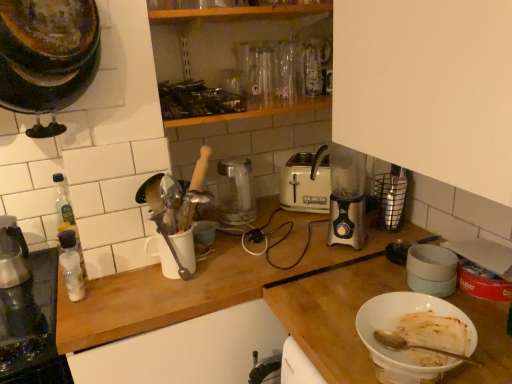
Question: Does white matte bowl at lower right, the 2th countertop when ordered from back to front, come in front of clear plastic bottle at left, the 1th bottle viewed from the front?

Choices:
 (A) no
 (B) yes

Answer: (B)

Question: From the image's perspective, does white matte bowl at lower right, the 2th countertop when ordered from back to front, appear higher than clear plastic bottle at left, the 1th bottle viewed from the front?

Choices:
 (A) no
 (B) yes

Answer: (A)

Question: Can you confirm if white matte bowl at lower right, the 2th countertop when ordered from back to front, is taller than clear plastic bottle at left, the second bottle in the back-to-front sequence?

Choices:
 (A) yes
 (B) no

Answer: (A)

Question: Can you confirm if white matte bowl at lower right, which is counted as the first countertop, starting from the front, is bigger than clear plastic bottle at left, the 1th bottle viewed from the front?

Choices:
 (A) yes
 (B) no

Answer: (A)

Question: From a real-world perspective, is white matte bowl at lower right, which is counted as the first countertop, starting from the front, positioned over clear plastic bottle at left, the second bottle in the back-to-front sequence, based on gravity?

Choices:
 (A) no
 (B) yes

Answer: (A)

Question: Does white matte bowl at lower right, the 2th countertop when ordered from back to front, touch clear plastic bottle at left, the 1th bottle viewed from the front?

Choices:
 (A) yes
 (B) no

Answer: (B)

Question: Is white matte bowl at lower right, the 2th countertop when ordered from back to front, a part of satin silver kettle at center, placed as the 1th kitchen appliance when sorted from back to front?

Choices:
 (A) yes
 (B) no

Answer: (B)

Question: Is satin silver kettle at center, the 2th kitchen appliance from the left, turned away from white matte bowl at lower right, the 2th countertop when ordered from back to front?

Choices:
 (A) yes
 (B) no

Answer: (B)

Question: Can you see satin silver kettle at center, placed as the 1th kitchen appliance when sorted from back to front, touching white matte bowl at lower right, the 2th countertop when ordered from back to front?

Choices:
 (A) yes
 (B) no

Answer: (B)

Question: Can you confirm if satin silver kettle at center, which appears as the 2th kitchen appliance when viewed from the right, is smaller than white matte bowl at lower right, the 2th countertop when ordered from back to front?

Choices:
 (A) yes
 (B) no

Answer: (A)

Question: Is satin silver kettle at center, which appears as the 2th kitchen appliance when viewed from the right, behind white matte bowl at lower right, which is counted as the first countertop, starting from the front?

Choices:
 (A) no
 (B) yes

Answer: (B)

Question: Can you confirm if satin silver kettle at center, placed as the 1th kitchen appliance when sorted from back to front, is positioned to the right of white matte bowl at lower right, which is counted as the first countertop, starting from the front?

Choices:
 (A) yes
 (B) no

Answer: (B)

Question: From a real-world perspective, is rusty metal pot at upper left, positioned as the third kitchen appliance in right-to-left order, over metallic glass carafe at left?

Choices:
 (A) no
 (B) yes

Answer: (B)